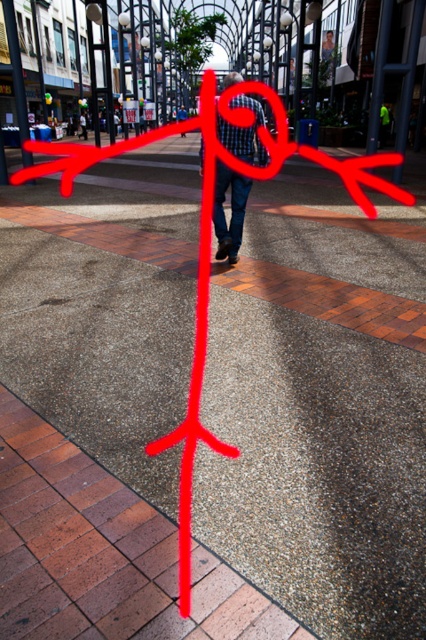
Question: Does metallic pole at upper right lie behind metallic pole at upper center?

Choices:
 (A) yes
 (B) no

Answer: (A)

Question: Which point is farther from the camera taking this photo?

Choices:
 (A) (230, 104)
 (B) (184, 116)
 (C) (14, 65)
 (D) (380, 81)

Answer: (B)

Question: Which of these objects is positioned farthest from the metallic pole at upper right?

Choices:
 (A) checkered fabric shirt at center
 (B) denim pants at center
 (C) denim jeans at center

Answer: (B)

Question: Which point is closer to the camera taking this photo?

Choices:
 (A) (181, 106)
 (B) (22, 118)
 (C) (370, 140)
 (D) (239, 173)

Answer: (D)

Question: Is metallic pole at upper center closer to camera compared to denim pants at center?

Choices:
 (A) no
 (B) yes

Answer: (B)

Question: Is metallic pole at upper center positioned at the back of denim jeans at center?

Choices:
 (A) no
 (B) yes

Answer: (A)